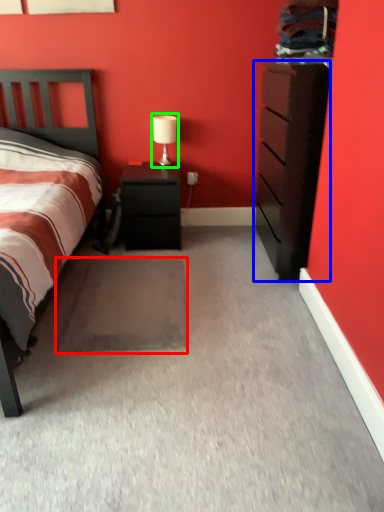
Question: Which object is positioned closest to footrest (highlighted by a red box)? Select from chest of drawers (highlighted by a blue box) and table lamp (highlighted by a green box).

Choices:
 (A) chest of drawers
 (B) table lamp

Answer: (A)